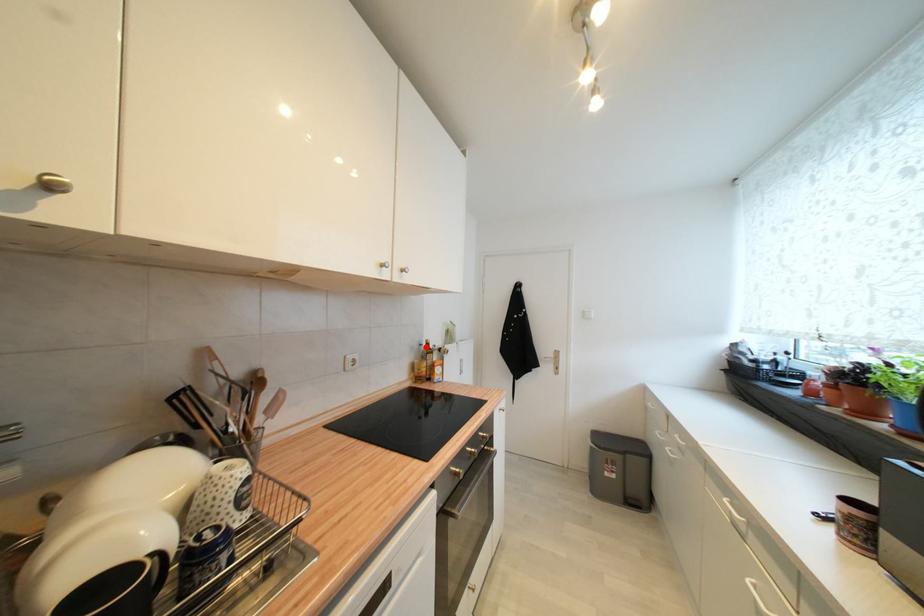
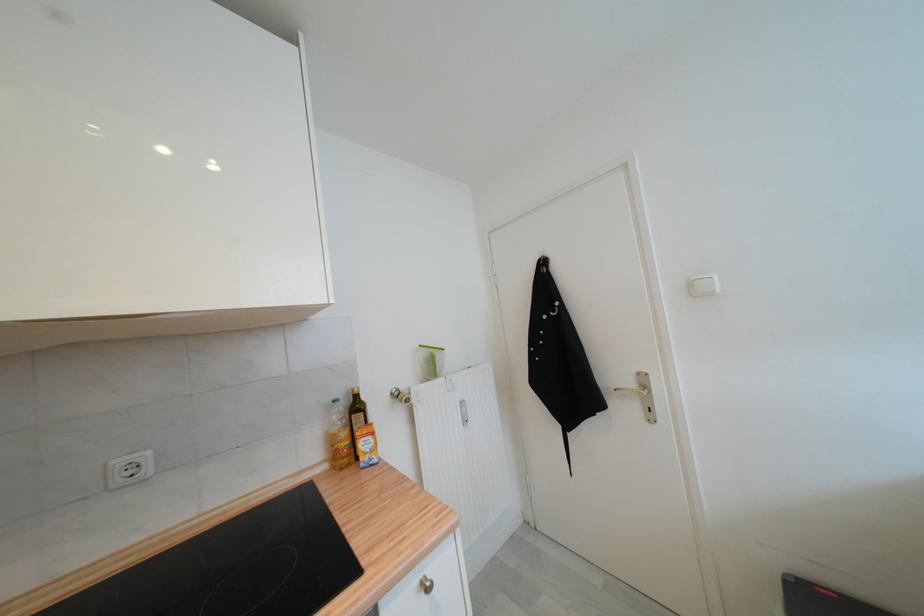
In the second image, find the point that corresponds to the highlighted location in the first image.

(339, 403)